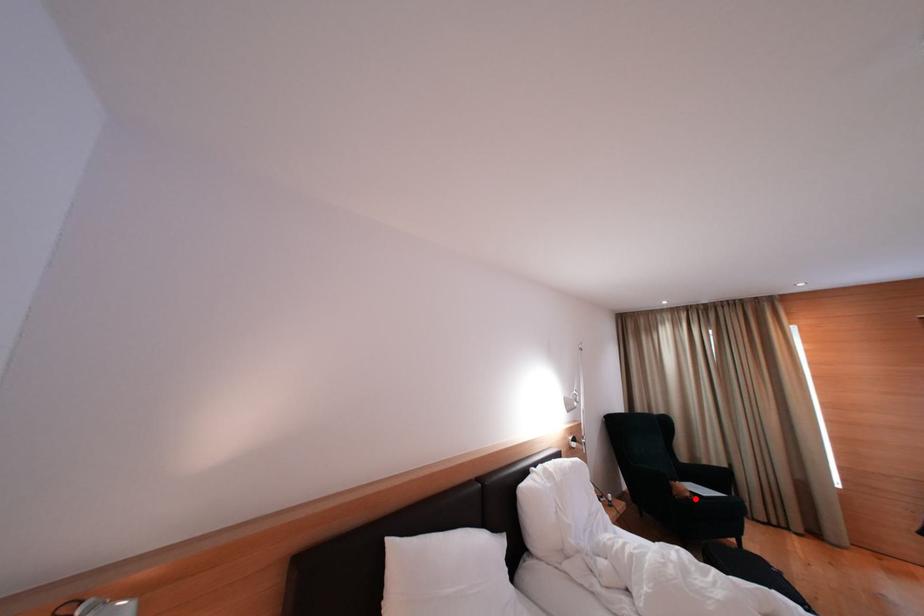
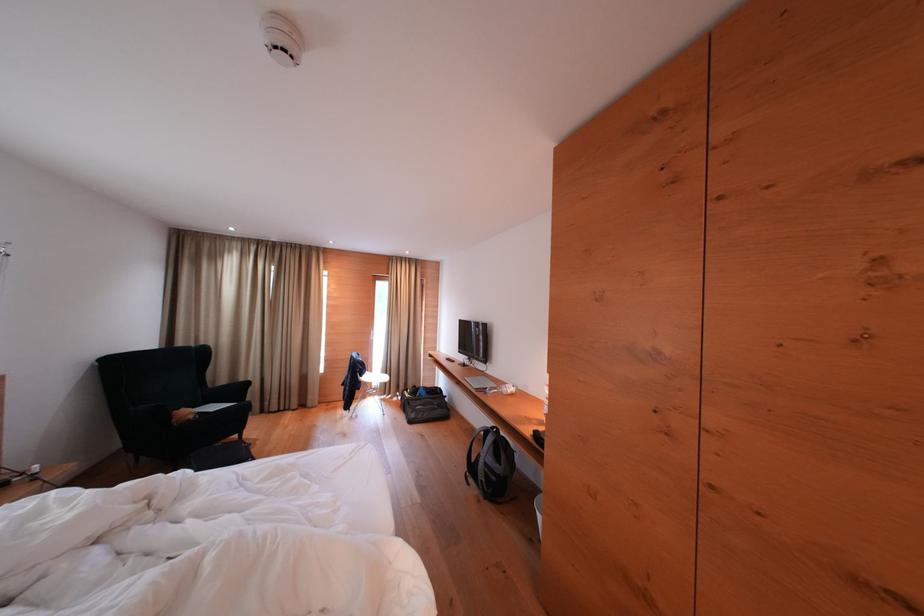
Question: A red point is marked in image1. In image2, is the corresponding 3D point closer to the camera or farther? Reply with the corresponding letter.

Choices:
 (A) The corresponding 3D point is closer.
 (B) The corresponding 3D point is farther.

Answer: (A)